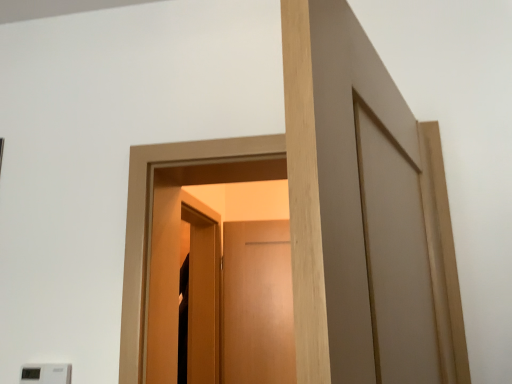
Question: From a real-world perspective, does matte wood screen door at center stand above white plastic light switch at lower left?

Choices:
 (A) yes
 (B) no

Answer: (A)

Question: Would you say matte wood screen door at center is outside white plastic light switch at lower left?

Choices:
 (A) yes
 (B) no

Answer: (A)

Question: Is matte wood screen door at center to the right of white plastic light switch at lower left from the viewer's perspective?

Choices:
 (A) no
 (B) yes

Answer: (B)

Question: Can you confirm if matte wood screen door at center is bigger than white plastic light switch at lower left?

Choices:
 (A) yes
 (B) no

Answer: (A)

Question: Is matte wood screen door at center looking in the opposite direction of white plastic light switch at lower left?

Choices:
 (A) no
 (B) yes

Answer: (A)

Question: Can white plastic light switch at lower left be found inside matte wood screen door at center?

Choices:
 (A) no
 (B) yes

Answer: (A)

Question: From a real-world perspective, is white plastic light switch at lower left beneath matte wood screen door at center?

Choices:
 (A) no
 (B) yes

Answer: (B)

Question: Is white plastic light switch at lower left aimed at matte wood screen door at center?

Choices:
 (A) no
 (B) yes

Answer: (A)

Question: Is white plastic light switch at lower left placed right next to matte wood screen door at center?

Choices:
 (A) yes
 (B) no

Answer: (B)

Question: From the image's perspective, is white plastic light switch at lower left below matte wood screen door at center?

Choices:
 (A) no
 (B) yes

Answer: (A)

Question: From a real-world perspective, is white plastic light switch at lower left over matte wood screen door at center?

Choices:
 (A) yes
 (B) no

Answer: (B)

Question: Is matte wood screen door at center inside white plastic light switch at lower left?

Choices:
 (A) no
 (B) yes

Answer: (A)

Question: In terms of width, does white plastic light switch at lower left look wider or thinner when compared to matte wood screen door at center?

Choices:
 (A) thin
 (B) wide

Answer: (A)